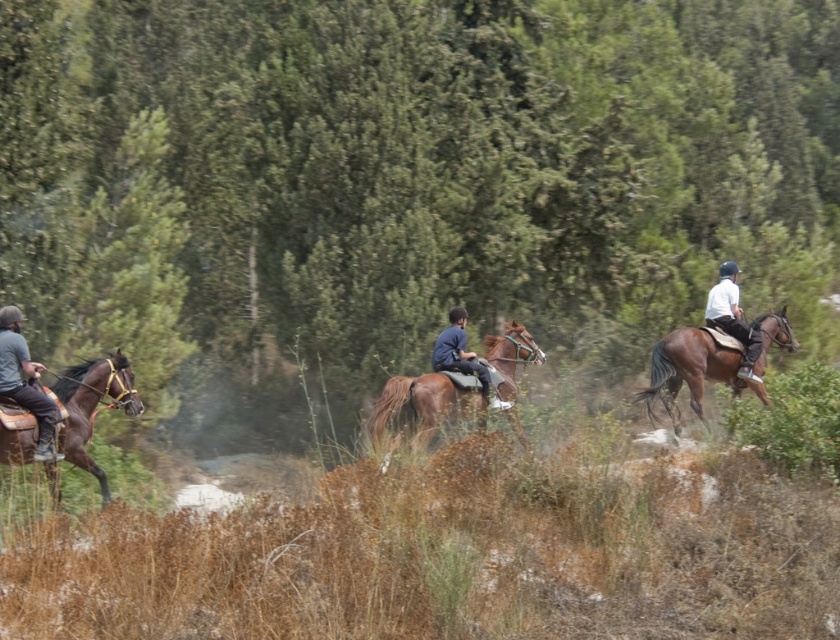
Looking at this image, you are a photographer positioned at the edge of the path. You want to capture a photo that includes both the white matte shirt at right and the dark blue fabric jacket at center. Given that your camera has a maximum focus range of 3 meters, will both subjects be in focus?

The white matte shirt at right is 3.48 meters from the dark blue fabric jacket at center. Since the distance between them exceeds the camera focus range of 3 meters, both subjects cannot be in focus simultaneously.

You are a photographer positioned at the center of the path. You want to take a photo that includes both the brown glossy horse at left and the white matte shirt at right. Which object should you focus on first to ensure both are in sharp focus?

You should focus on the brown glossy horse at left first because it is closer to the viewer than the white matte shirt at right, so adjusting focus from near to far will help both be in sharp focus.

You are a photographer positioned at the origin point of the image. You want to take a photo of the white matte shirt at right. What are the coordinates of the shirt?

The white matte shirt at right is located at coordinates point (733,317), so you should aim your camera at those coordinates to capture it.